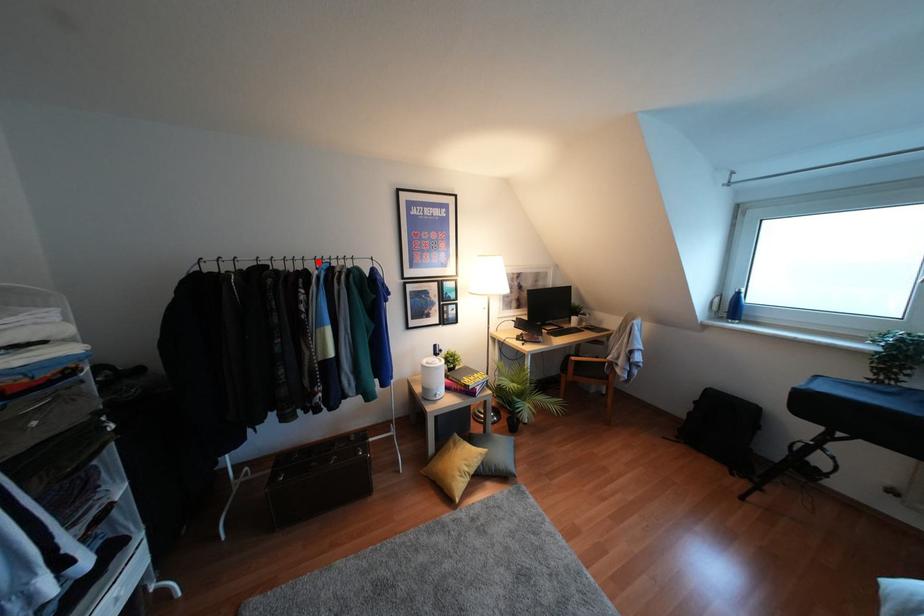
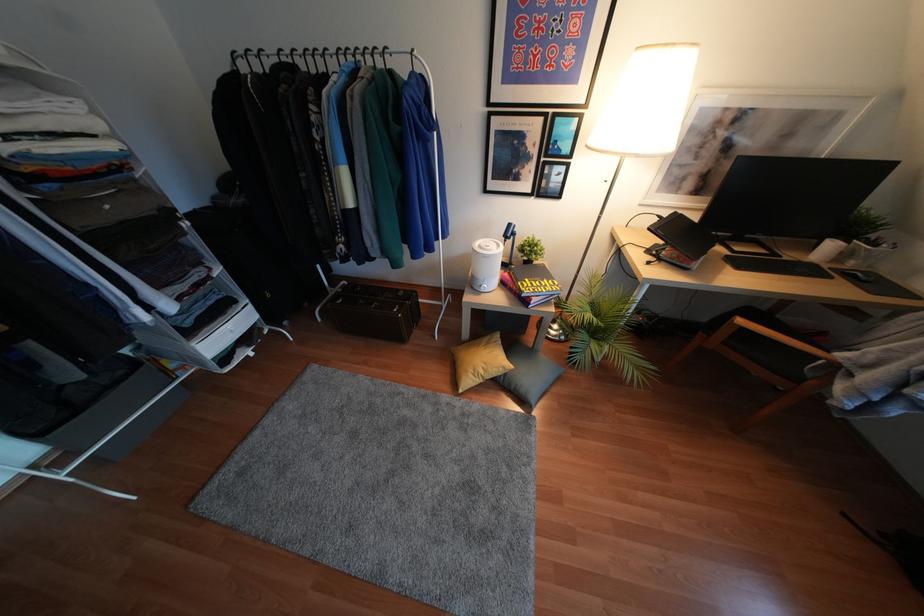
Find the pixel in the second image that matches the highlighted location in the first image.

(342, 59)